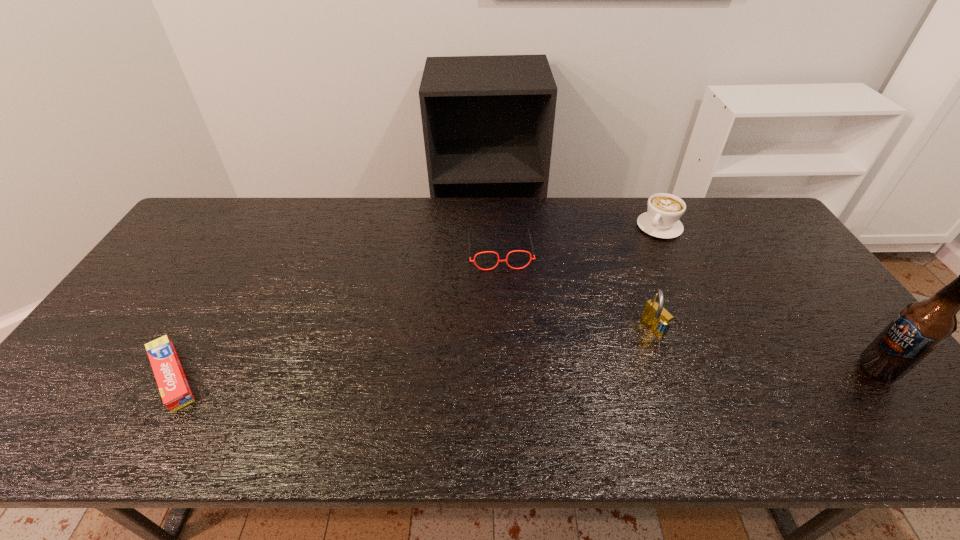
Image resolution: width=960 pixels, height=540 pixels. I want to click on blank space located 0.200m to the right of the cappuccino's handle, so click(627, 271).

Locate an element on the screen. The width and height of the screenshot is (960, 540). vacant space located to the right of the cappuccino's handle is located at coordinates (623, 276).

Where is `vacant space situated 0.380m to the right of the cappuccino's handle`? This screenshot has height=540, width=960. vacant space situated 0.380m to the right of the cappuccino's handle is located at coordinates (601, 306).

Identify the location of spectacles that is at the far edge. This screenshot has height=540, width=960. (531, 258).

Where is `cappuccino that is at the far edge`? cappuccino that is at the far edge is located at coordinates coord(661,220).

At what (x,y) coordinates should I click in order to perform the action: click on toothpaste present at the near edge. Please return your answer as a coordinate pair (x, y). Looking at the image, I should click on (175, 391).

Where is `beer bottle that is at the near edge`? beer bottle that is at the near edge is located at coordinates pyautogui.click(x=920, y=327).

This screenshot has width=960, height=540. What are the coordinates of `object at the left edge` in the screenshot? It's located at (175, 391).

At what (x,y) coordinates should I click in order to perform the action: click on object that is at the right edge. Please return your answer as a coordinate pair (x, y). The width and height of the screenshot is (960, 540). Looking at the image, I should click on (920, 327).

At what (x,y) coordinates should I click in order to perform the action: click on object present at the near left corner. Please return your answer as a coordinate pair (x, y). This screenshot has width=960, height=540. Looking at the image, I should click on (175, 391).